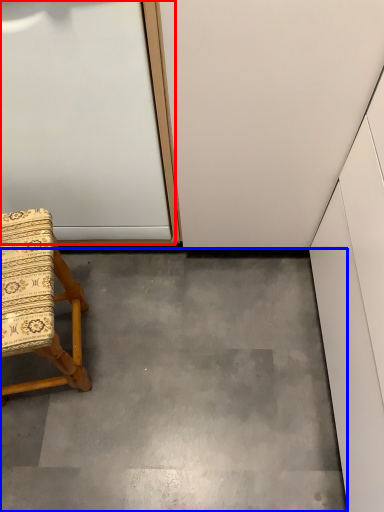
Question: Among these objects, which one is farthest to the camera, door (highlighted by a red box) or concrete (highlighted by a blue box)?

Choices:
 (A) door
 (B) concrete

Answer: (B)